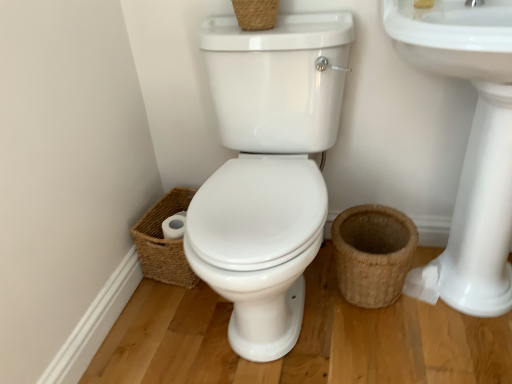
At what (x,y) coordinates should I click in order to perform the action: click on vacant space that's between white glossy sink at upper right, the first sink in the left-to-right sequence, and woven brown basket at lower left, the second basket when ordered from bottom to top. Please return your answer as a coordinate pair (x, y). The image size is (512, 384). Looking at the image, I should click on (163, 320).